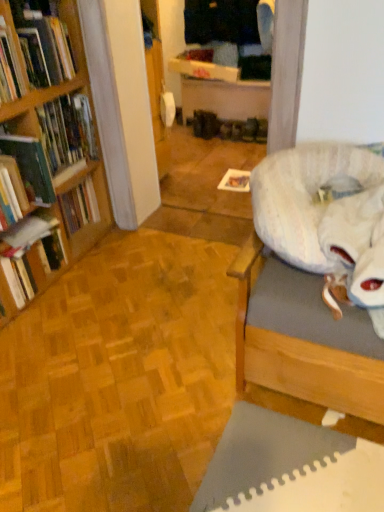
What do you see at coordinates (67, 131) in the screenshot?
I see `green matte bookshelf at left, the 3th book when ordered from bottom to top` at bounding box center [67, 131].

What do you see at coordinates (250, 129) in the screenshot? The image size is (384, 512). I see `matte brown shoe at center` at bounding box center [250, 129].

You are a GUI agent. You are given a task and a screenshot of the screen. Output one action in this format:
    pyautogui.click(x=<x>, y=<y>)
    Task: Click on the matte brown shoe at center
    
    Given the screenshot: What is the action you would take?
    pyautogui.click(x=250, y=129)

Measure the distance between hardcover book at left, positioned as the first book in bottom-to-top order, and camera.

The distance of hardcover book at left, positioned as the first book in bottom-to-top order, from camera is 1.66 meters.

In order to face hardcover book at left, positioned as the first book in bottom-to-top order, should I rotate leftwards or rightwards?

To face it directly, rotate left by 22.314 degrees.

Locate an element on the screen. wooden bookshelf at left, the 4th book positioned from the bottom is located at coordinates (33, 52).

Image resolution: width=384 pixels, height=512 pixels. I want to click on green matte bookshelf at left, the second book in the top-to-bottom sequence, so click(67, 131).

From a real-world perspective, is hardcover book at left, positioned as the second book in bottom-to-top order, physically below green matte bookshelf at left, the second book in the top-to-bottom sequence?

Yes, from a real-world perspective, hardcover book at left, positioned as the second book in bottom-to-top order, is below green matte bookshelf at left, the second book in the top-to-bottom sequence.

In the scene shown: Can you confirm if hardcover book at left, the 3th book positioned from the top, is taller than green matte bookshelf at left, the 3th book when ordered from bottom to top?

No, hardcover book at left, the 3th book positioned from the top, is not taller than green matte bookshelf at left, the 3th book when ordered from bottom to top.

How different are the orientations of hardcover book at left, the 3th book positioned from the top, and green matte bookshelf at left, the 3th book when ordered from bottom to top, in degrees?

They differ by 0.0007 degrees in their facing directions.

From a real-world perspective, which is physically below, hardcover book at left, the 3th book positioned from the top, or fluffy white bean bag at right?

From a 3D spatial view, fluffy white bean bag at right is below.

From the image's perspective, is hardcover book at left, the 3th book positioned from the top, above or below fluffy white bean bag at right?

Clearly, from the image's perspective, hardcover book at left, the 3th book positioned from the top, is above fluffy white bean bag at right.

Is hardcover book at left, the 3th book positioned from the top, turned away from fluffy white bean bag at right?

No, hardcover book at left, the 3th book positioned from the top,'s orientation is not away from fluffy white bean bag at right.

Considering the relative sizes of hardcover book at left, acting as the fourth book starting from the top, and wooden bookshelf at left, the 4th book positioned from the bottom, in the image provided, is hardcover book at left, acting as the fourth book starting from the top, bigger than wooden bookshelf at left, the 4th book positioned from the bottom,?

Incorrect, hardcover book at left, acting as the fourth book starting from the top, is not larger than wooden bookshelf at left, the 4th book positioned from the bottom.

Considering the relative positions of hardcover book at left, positioned as the first book in bottom-to-top order, and wooden bookshelf at left, the 4th book positioned from the bottom, in the image provided, is hardcover book at left, positioned as the first book in bottom-to-top order, to the left of wooden bookshelf at left, the 4th book positioned from the bottom, from the viewer's perspective?

Yes.

Is wooden bookshelf at left, the 4th book positioned from the bottom, completely or partially inside hardcover book at left, acting as the fourth book starting from the top?

No, wooden bookshelf at left, the 4th book positioned from the bottom, is not inside hardcover book at left, acting as the fourth book starting from the top.

How far apart are hardcover book at left, acting as the fourth book starting from the top, and wooden bookshelf at left, the 4th book positioned from the bottom?

24.97 inches.

The height and width of the screenshot is (512, 384). In the image, there is a hardcover book at left, the 3th book positioned from the top. Find the location of `footwear above it (from the image's perspective)`. footwear above it (from the image's perspective) is located at coordinates (250, 129).

Based on the photo, how distant is matte brown shoe at center from hardcover book at left, positioned as the second book in bottom-to-top order?

6.98 feet.

Between matte brown shoe at center and hardcover book at left, the 3th book positioned from the top, which one has less height?

matte brown shoe at center.

How different are the orientations of matte brown shoe at center and hardcover book at left, the 3th book positioned from the top, in degrees?

The angular difference between matte brown shoe at center and hardcover book at left, the 3th book positioned from the top, is 88.2 degrees.

Which object is wider, matte brown shoe at center or hardcover book at left, positioned as the first book in bottom-to-top order?

With larger width is hardcover book at left, positioned as the first book in bottom-to-top order.

Find the location of `footwear above the hardcover book at left, acting as the fourth book starting from the top (from the image's perspective)`. footwear above the hardcover book at left, acting as the fourth book starting from the top (from the image's perspective) is located at coordinates (250, 129).

Is matte brown shoe at center inside the boundaries of hardcover book at left, positioned as the first book in bottom-to-top order, or outside?

matte brown shoe at center exists outside the volume of hardcover book at left, positioned as the first book in bottom-to-top order.

From the image's perspective, is matte brown shoe at center located above hardcover book at left, acting as the fourth book starting from the top?

Indeed, from the image's perspective, matte brown shoe at center is shown above hardcover book at left, acting as the fourth book starting from the top.

Is point (20, 260) closer to viewer compared to point (316, 183)?

No, (20, 260) is further to viewer.

Locate an element on the screen. This screenshot has height=512, width=384. the 3rd book behind when counting from the fluffy white bean bag at right is located at coordinates (30, 251).

Can you confirm if hardcover book at left, positioned as the first book in bottom-to-top order, is shorter than fluffy white bean bag at right?

Incorrect, the height of hardcover book at left, positioned as the first book in bottom-to-top order, does not fall short of that of fluffy white bean bag at right.

From a real-world perspective, does wooden bookshelf at left, the 4th book positioned from the bottom, sit lower than hardcover book at left, positioned as the second book in bottom-to-top order?

No, from a real-world perspective, wooden bookshelf at left, the 4th book positioned from the bottom, is not beneath hardcover book at left, positioned as the second book in bottom-to-top order.

Where is `book that is the 2nd object above the hardcover book at left, positioned as the second book in bottom-to-top order (from a real-world perspective)`? The image size is (384, 512). book that is the 2nd object above the hardcover book at left, positioned as the second book in bottom-to-top order (from a real-world perspective) is located at coordinates (33, 52).

From their relative heights in the image, would you say wooden bookshelf at left, which is the first book from top to bottom, is taller or shorter than hardcover book at left, the 3th book positioned from the top?

In the image, wooden bookshelf at left, which is the first book from top to bottom, appears to be taller than hardcover book at left, the 3th book positioned from the top.

Could you tell me if wooden bookshelf at left, which is the first book from top to bottom, is facing hardcover book at left, positioned as the second book in bottom-to-top order?

No, wooden bookshelf at left, which is the first book from top to bottom, is not facing towards hardcover book at left, positioned as the second book in bottom-to-top order.

What are the coordinates of `book that is the 1st object located below the green matte bookshelf at left, the second book in the top-to-bottom sequence (from the image's perspective)` in the screenshot? It's located at (30, 167).

There is a fluffy white bean bag at right. In order to click on the 1st book above it (from a real-world perspective) in this screenshot , I will do `click(30, 167)`.

Considering their positions, is hardcover book at left, acting as the fourth book starting from the top, positioned closer to hardcover book at left, positioned as the second book in bottom-to-top order, than matte brown shoe at center?

hardcover book at left, acting as the fourth book starting from the top, is closer to hardcover book at left, positioned as the second book in bottom-to-top order.

Looking at the image, which one is located further to hardcover book at left, the 3th book positioned from the top, hardcover book at left, acting as the fourth book starting from the top, or green matte bookshelf at left, the 3th book when ordered from bottom to top?

The object further to hardcover book at left, the 3th book positioned from the top, is green matte bookshelf at left, the 3th book when ordered from bottom to top.

Which object lies nearer to the anchor point green matte bookshelf at left, the 3th book when ordered from bottom to top, matte brown shoe at center or hardcover book at left, positioned as the second book in bottom-to-top order?

Based on the image, hardcover book at left, positioned as the second book in bottom-to-top order, appears to be nearer to green matte bookshelf at left, the 3th book when ordered from bottom to top.

From the image, which object appears to be nearer to green matte bookshelf at left, the second book in the top-to-bottom sequence, wooden bookshelf at left, which is the first book from top to bottom, or hardcover book at left, acting as the fourth book starting from the top?

The object closer to green matte bookshelf at left, the second book in the top-to-bottom sequence, is wooden bookshelf at left, which is the first book from top to bottom.

Estimate the real-world distances between objects in this image. Which object is closer to fluffy white bean bag at right, wooden bookshelf at left, the 4th book positioned from the bottom, or matte brown shoe at center?

The object closer to fluffy white bean bag at right is wooden bookshelf at left, the 4th book positioned from the bottom.

Looking at the image, which one is located closer to wooden bookshelf at left, which is the first book from top to bottom, matte brown shoe at center or fluffy white bean bag at right?

The object closer to wooden bookshelf at left, which is the first book from top to bottom, is fluffy white bean bag at right.

From the image, which object appears to be farther from wooden bookshelf at left, which is the first book from top to bottom, hardcover book at left, positioned as the second book in bottom-to-top order, or fluffy white bean bag at right?

fluffy white bean bag at right is further to wooden bookshelf at left, which is the first book from top to bottom.

From the image, which object appears to be nearer to green matte bookshelf at left, the second book in the top-to-bottom sequence, hardcover book at left, the 3th book positioned from the top, or wooden bookshelf at left, which is the first book from top to bottom?

wooden bookshelf at left, which is the first book from top to bottom.

In order to click on book between hardcover book at left, acting as the fourth book starting from the top, and matte brown shoe at center in the front-back direction in this screenshot , I will do `click(67, 131)`.

At what (x,y) coordinates should I click in order to perform the action: click on book between green matte bookshelf at left, the 3th book when ordered from bottom to top, and hardcover book at left, acting as the fourth book starting from the top, in the vertical direction. Please return your answer as a coordinate pair (x, y). Looking at the image, I should click on (30, 167).

Identify the location of book between green matte bookshelf at left, the second book in the top-to-bottom sequence, and fluffy white bean bag at right, in the horizontal direction. The image size is (384, 512). (33, 52).

Locate an element on the screen. This screenshot has width=384, height=512. book between wooden bookshelf at left, the 4th book positioned from the bottom, and hardcover book at left, positioned as the second book in bottom-to-top order, vertically is located at coordinates (67, 131).